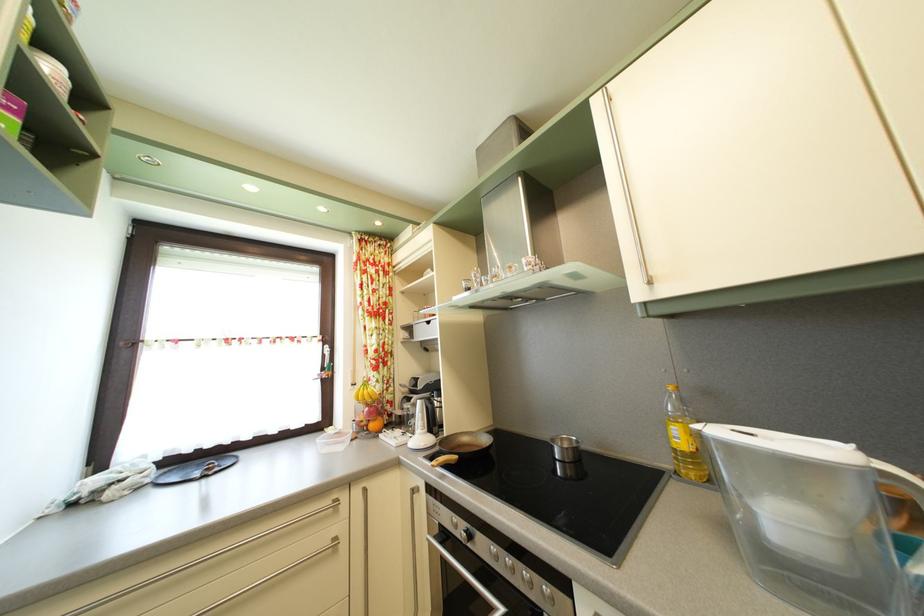
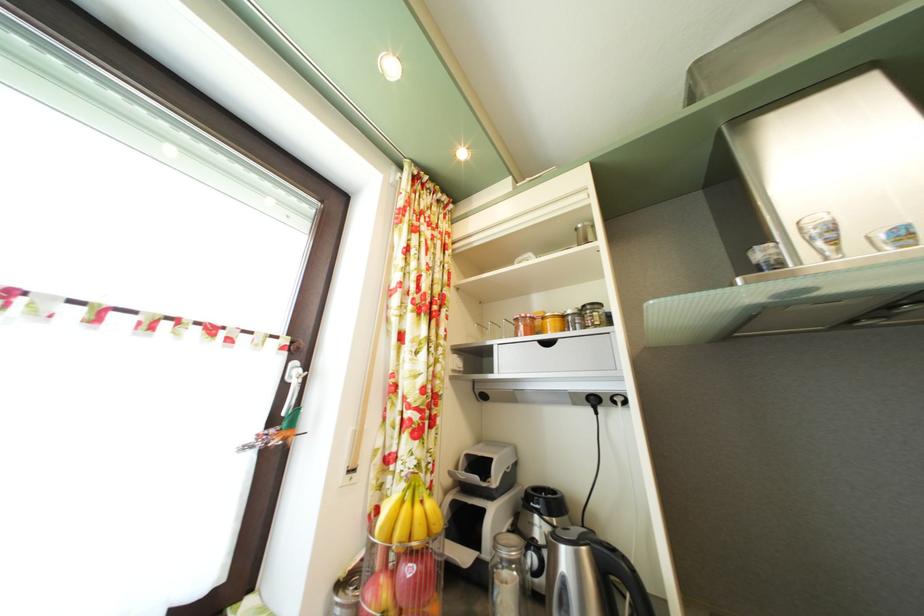
Locate, in the second image, the point that corresponds to [334,354] in the first image.

(304, 371)